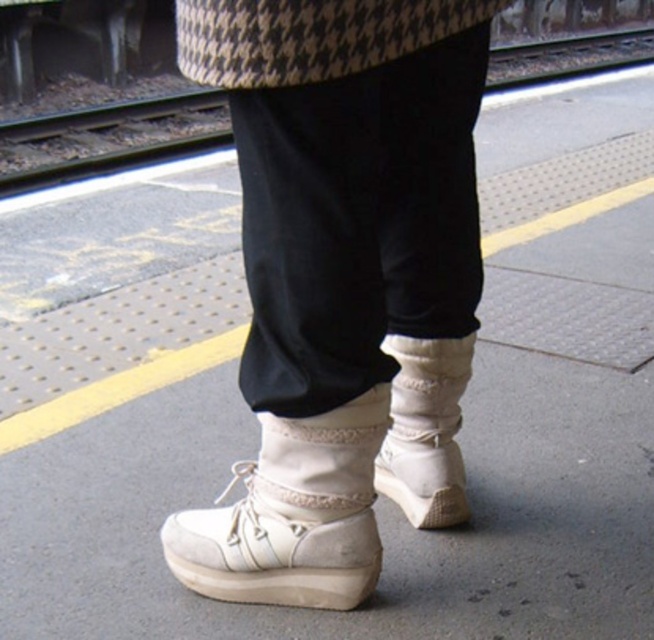
Question: Which of the following is the farthest from the observer?

Choices:
 (A) metal train track at upper left
 (B) white suede sneakers at center

Answer: (A)

Question: Is the position of white suede sneaker at center less distant than that of beige suede boot at center?

Choices:
 (A) no
 (B) yes

Answer: (B)

Question: Which object is closer to the camera taking this photo?

Choices:
 (A) white suede sneakers at center
 (B) beige suede boot at center
 (C) metal train track at upper left
 (D) white suede sneaker at center

Answer: (A)

Question: Which point appears closest to the camera in this image?

Choices:
 (A) (458, 339)
 (B) (284, 157)
 (C) (224, 141)
 (D) (207, 524)

Answer: (B)

Question: Is white suede sneakers at center closer to the viewer compared to white suede sneaker at center?

Choices:
 (A) no
 (B) yes

Answer: (B)

Question: Can you confirm if white suede sneaker at center is thinner than metal train track at upper left?

Choices:
 (A) yes
 (B) no

Answer: (A)